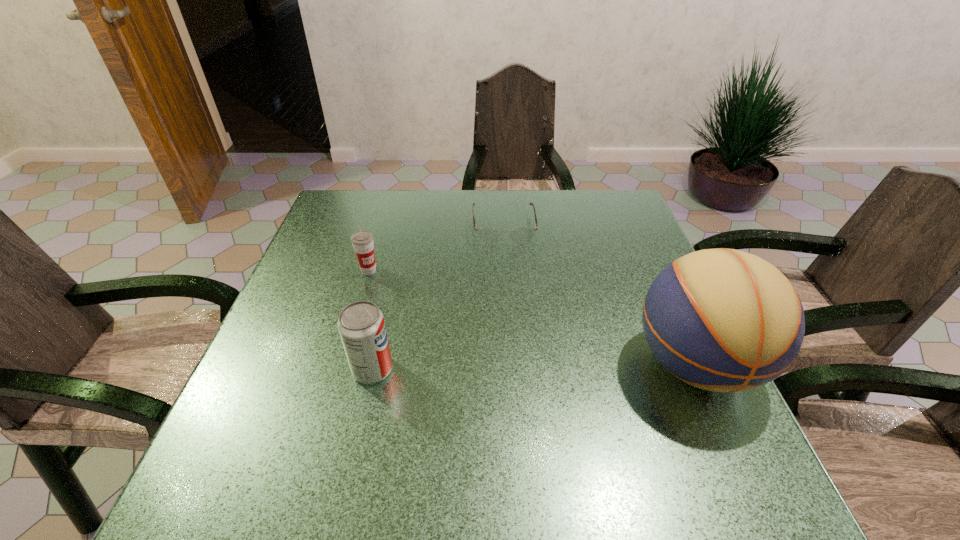
Where is `soda`? The width and height of the screenshot is (960, 540). soda is located at coordinates (361, 325).

Identify the location of the tallest object. The width and height of the screenshot is (960, 540). (723, 320).

Locate an element on the screen. Image resolution: width=960 pixels, height=540 pixels. basketball is located at coordinates (723, 320).

This screenshot has width=960, height=540. I want to click on cup, so tap(362, 241).

Image resolution: width=960 pixels, height=540 pixels. Identify the location of the second object from right to left. (489, 236).

Locate an element on the screen. the farthest object is located at coordinates (489, 236).

Find the location of a particular element. Image resolution: width=960 pixels, height=540 pixels. blank area located on the right of the soda is located at coordinates (537, 369).

The image size is (960, 540). Identify the location of free space located on the side of the cup with the logo. (425, 316).

At what (x,y) coordinates should I click in order to perform the action: click on vacant point located on the side of the cup with the logo. Please return your answer as a coordinate pair (x, y). Looking at the image, I should click on (462, 345).

Find the location of `vacant area situated 0.390m on the side of the cup with the logo`. vacant area situated 0.390m on the side of the cup with the logo is located at coordinates (486, 363).